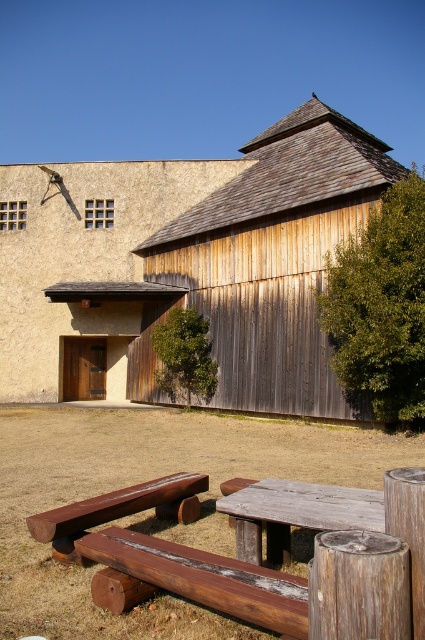
Can you confirm if wooden barn at center is positioned below weathered wood bench at lower center?

No, wooden barn at center is not below weathered wood bench at lower center.

In the scene shown: Is wooden barn at center wider than weathered wood bench at lower center?

Correct, the width of wooden barn at center exceeds that of weathered wood bench at lower center.

Identify the location of wooden barn at center. Image resolution: width=425 pixels, height=640 pixels. (186, 266).

Locate an element on the screen. wooden barn at center is located at coordinates (186, 266).

Which is in front, point (178, 557) or point (382, 502)?

Point (178, 557) is more forward.

Is point (272, 628) more distant than point (251, 561)?

No.

This screenshot has width=425, height=640. I want to click on weathered wood bench at lower center, so click(x=206, y=579).

Is point (184, 580) positioned before point (59, 538)?

Yes, point (184, 580) is closer to viewer.

Does weathered wood bench at lower center have a greater height compared to rustic wood bench at lower center?

Incorrect, weathered wood bench at lower center's height is not larger of rustic wood bench at lower center's.

Does point (198, 554) lie in front of point (124, 515)?

Yes, it is in front of point (124, 515).

You are a GUI agent. You are given a task and a screenshot of the screen. Output one action in this format:
    pyautogui.click(x=<x>, y=<y>)
    Task: Click on the weathered wood bench at lower center
    Image resolution: width=425 pixels, height=640 pixels.
    Given the screenshot: What is the action you would take?
    pyautogui.click(x=206, y=579)